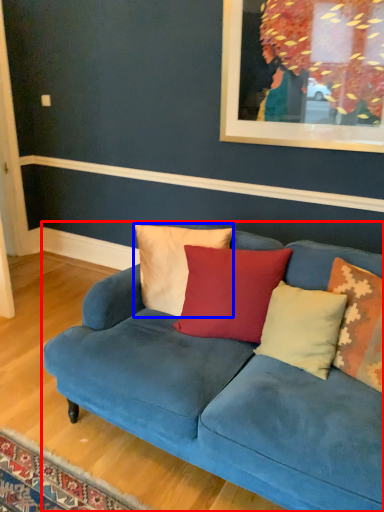
Question: Which point is closer to the camera, studio couch (highlighted by a red box) or pillow (highlighted by a blue box)?

Choices:
 (A) studio couch
 (B) pillow

Answer: (A)